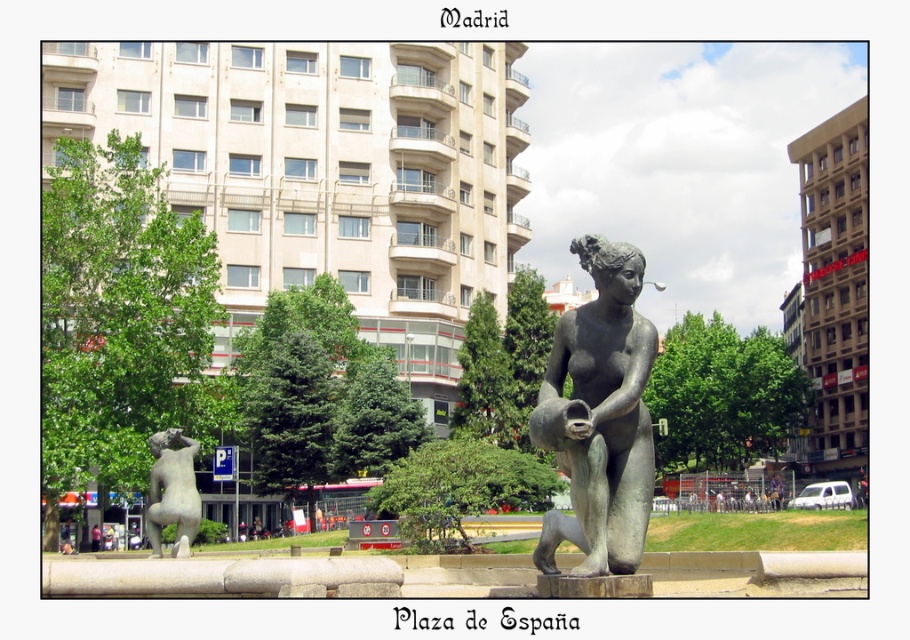
You are standing at the edge of Plaza de espa?a in Madrid, and you want to take a photo of the bronze statue at center. If your camera has a maximum focus range of 70 feet, will you be able to capture the statue clearly?

The bronze statue at center and camera are 71.64 feet apart from each other. Since the camera can only focus up to 70 feet, you will not be able to capture the statue clearly.

You are a tourist in Plaza de espa?a and you want to take a photo of both the bronze statue at center and the bronze statue at lower left. Since you want to include both in the frame, which statue should you position closer to the camera to ensure both are visible?

The bronze statue at center is smaller than the bronze statue at lower left. To include both in the frame, you should position the bronze statue at center closer to the camera since it is smaller and needs to be magnified to appear similar in size to the larger bronze statue at lower left in the photo.

You are standing in Plaza de espa?a and want to take a photo of the bronze statue at center and the bronze statue at lower left. Which statue is closer to you?

The bronze statue at lower left is closer to you because the bronze statue at center is positioned over it, meaning it is further away.